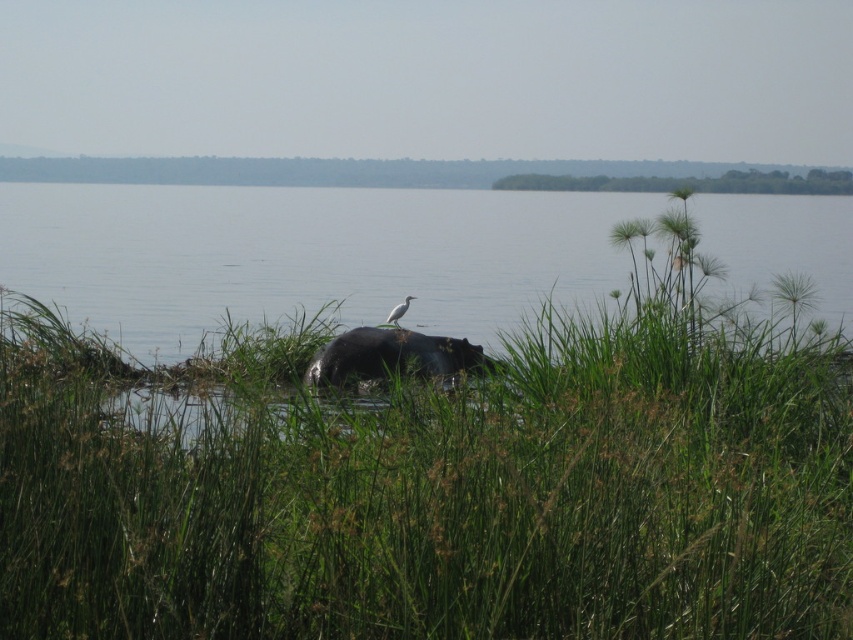
You are standing on the bank of the lake and want to walk to the hippo. The path leads through the green leafy grass at center and the clear water at hippo center. Which part of the path is taller?

The clear water at hippo center is taller than the green leafy grass at center according to the description.

You are standing at the edge of the lake and see the green leafy grass at center. Based on its position, can you determine if it is closer to you or farther away compared to the hippopotamus?

The green leafy grass at center is located at point 0.769 on the x and 0.509 on the y axis, which places it in the mid to foreground. Since the hippo is in the foreground, the grass is farther away than the hippo.

In the scene shown: You are a photographer trying to capture the hippo and the bird in the background. You notice green leafy grass at center and clear water at hippo center in your viewfinder. Which object is closer to you, the photographer?

The green leafy grass at center is closer to you because it is in front of the clear water at hippo center.